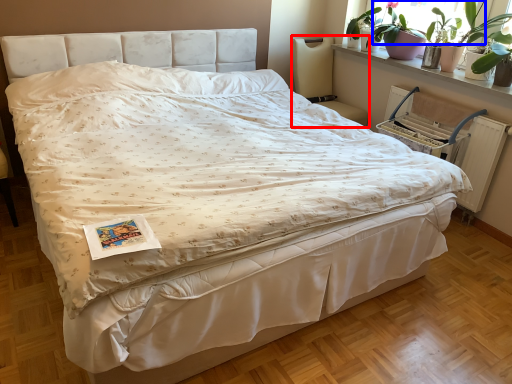
Question: Which of the following is the farthest to the observer, chair (highlighted by a red box) or window screen (highlighted by a blue box)?

Choices:
 (A) chair
 (B) window screen

Answer: (A)